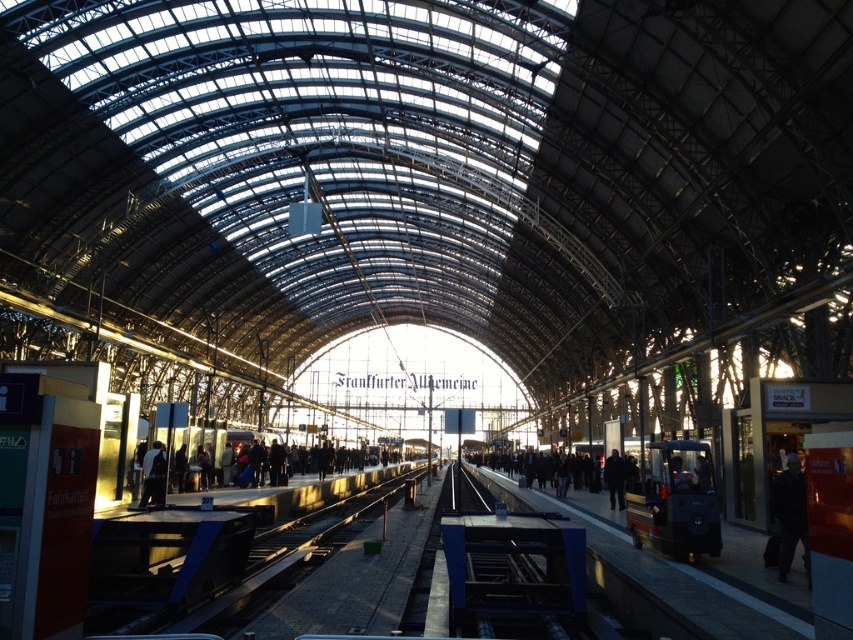
You are standing at the entrance of the train station and want to reach the point marked at coordinates point (790, 532). Given that the distance between you and the point is 56.63 feet, can you estimate how far you need to walk to reach it?

The point (790, 532) is 56.63 feet away from you, so you need to walk approximately 56.63 feet to reach it.

Looking at this image, you are a maintenance worker standing on the platform near the matte black train at right. You need to walk to the black fabric person at center to discuss the inspection report. How far will you have to walk to reach them?

The matte black train at right is 7.67 meters from the black fabric person at center, so you will have to walk 7.67 meters to reach them.

You are standing at the entrance of the train station and want to reach a specific maintenance point located at point (146, 481). Given that the station is 100 feet long from entrance to the farthest point, is the point within the first half of the station?

The distance of point (146, 481) from the viewer is 96.76 feet. Since the station is 100 feet long, the first half would be up to 50 feet. Therefore, the point is beyond the first half of the station.